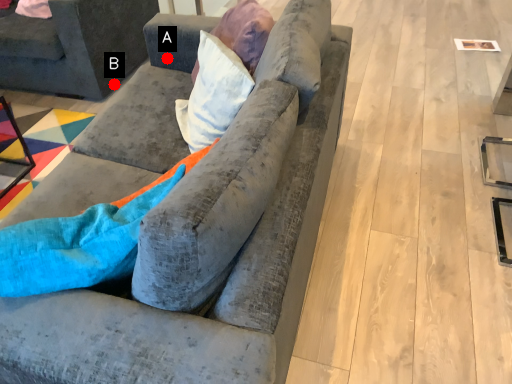
Question: Two points are circled on the image, labeled by A and B beside each circle. Among these points, which one is farthest from the camera?

Choices:
 (A) A is further
 (B) B is further

Answer: (B)